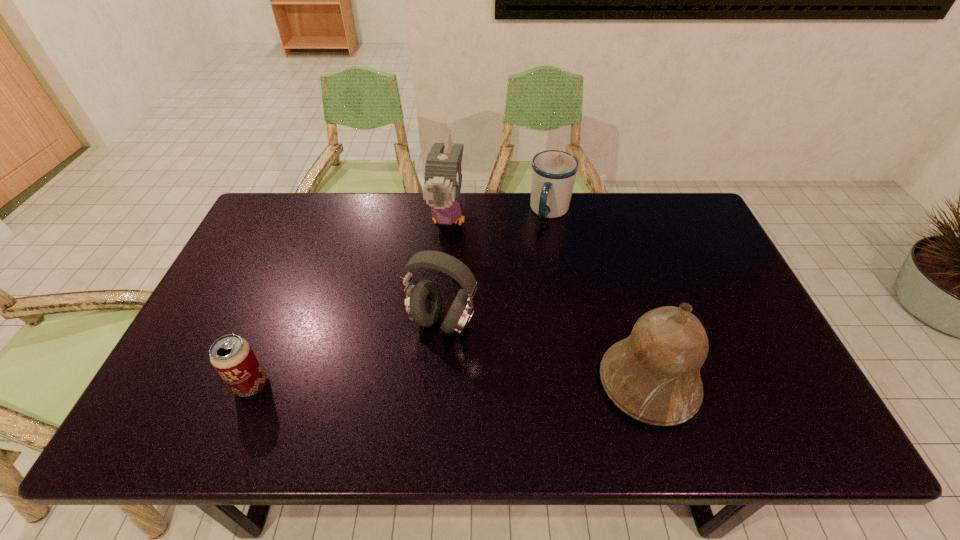
Where is `beer can`? The height and width of the screenshot is (540, 960). beer can is located at coordinates (233, 358).

The image size is (960, 540). Find the location of `the shortest object`. the shortest object is located at coordinates (233, 358).

Find the location of a particular element. This screenshot has width=960, height=540. bell is located at coordinates (653, 375).

Find the location of `headset`. headset is located at coordinates (423, 302).

You are a GUI agent. You are given a task and a screenshot of the screen. Output one action in this format:
    pyautogui.click(x=<x>, y=<y>)
    Task: Click on the bird
    The height and width of the screenshot is (540, 960).
    Given the screenshot: What is the action you would take?
    pyautogui.click(x=443, y=178)

Find the location of a particular element. The image size is (960, 540). mug is located at coordinates (553, 172).

You are a GUI agent. You are given a task and a screenshot of the screen. Output one action in this format:
    pyautogui.click(x=<x>, y=<y>)
    Task: Click on the free region located 0.240m on the back of the shortest object
    The image size is (960, 540).
    Given the screenshot: What is the action you would take?
    pyautogui.click(x=288, y=296)

This screenshot has height=540, width=960. I want to click on vacant space located on the left of the bell, so click(497, 383).

Where is `vacant space located on the ear cups of the headset`? vacant space located on the ear cups of the headset is located at coordinates (408, 370).

Image resolution: width=960 pixels, height=540 pixels. I want to click on vacant space situated 0.160m on the ear cups of the headset, so click(x=394, y=394).